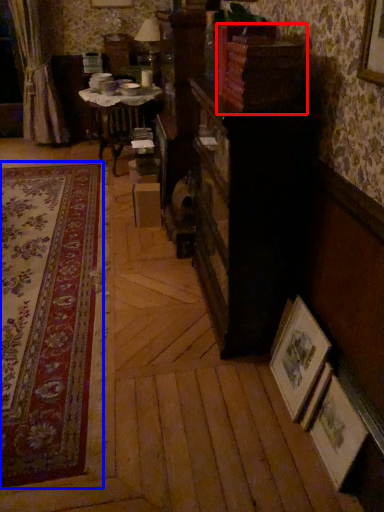
Question: Among these objects, which one is nearest to the camera, shelf (highlighted by a red box) or plain (highlighted by a blue box)?

Choices:
 (A) shelf
 (B) plain

Answer: (B)